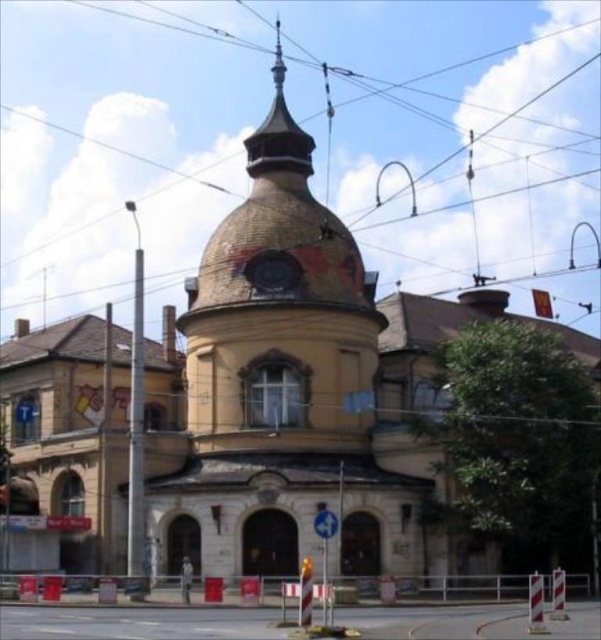
You are an architect evaluating the building design. The gold textured spire at upper center and the shiny silver spire at upper center are both part of the dome structure. Which spire would be more noticeable from a distance due to its size?

The gold textured spire at upper center is larger in size than the shiny silver spire at upper center, making it more noticeable from a distance.

From the picture: You are a city planner assessing the height of two architectural features on a building. You see the brown textured dome at center and the shiny silver spire at upper center. Which one is shorter in height?

The brown textured dome at center is shorter in height than the shiny silver spire at upper center.